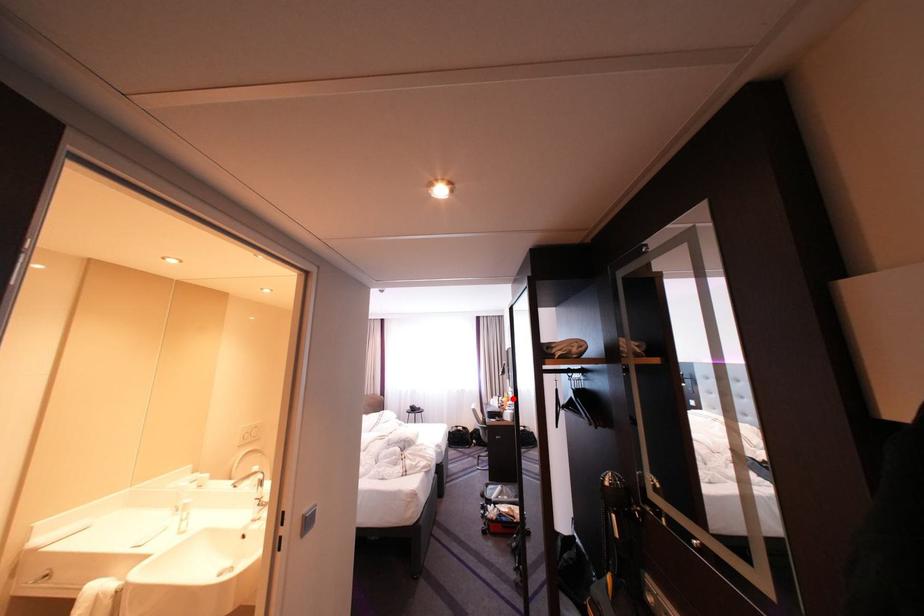
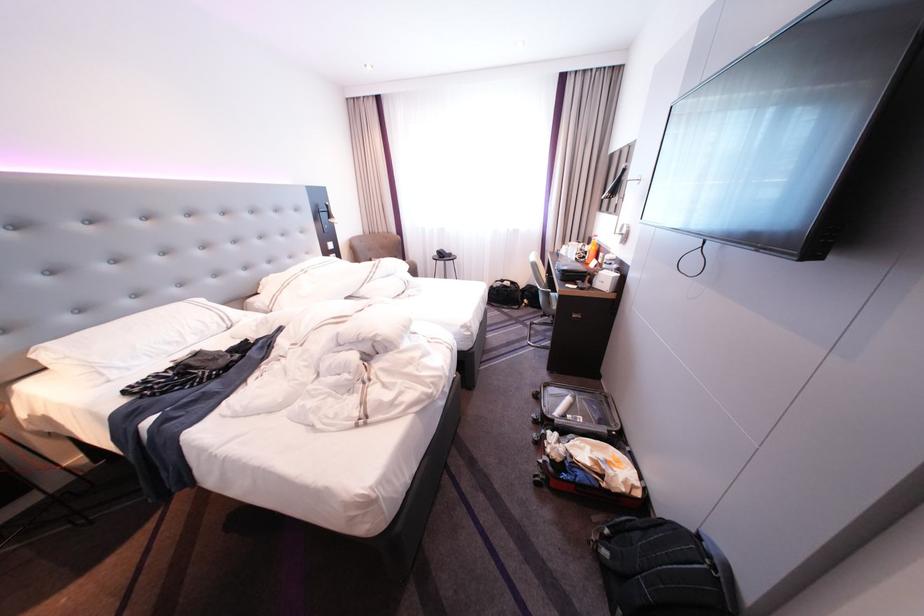
In the second image, find the point that corresponds to the highlighted location in the first image.

(593, 245)